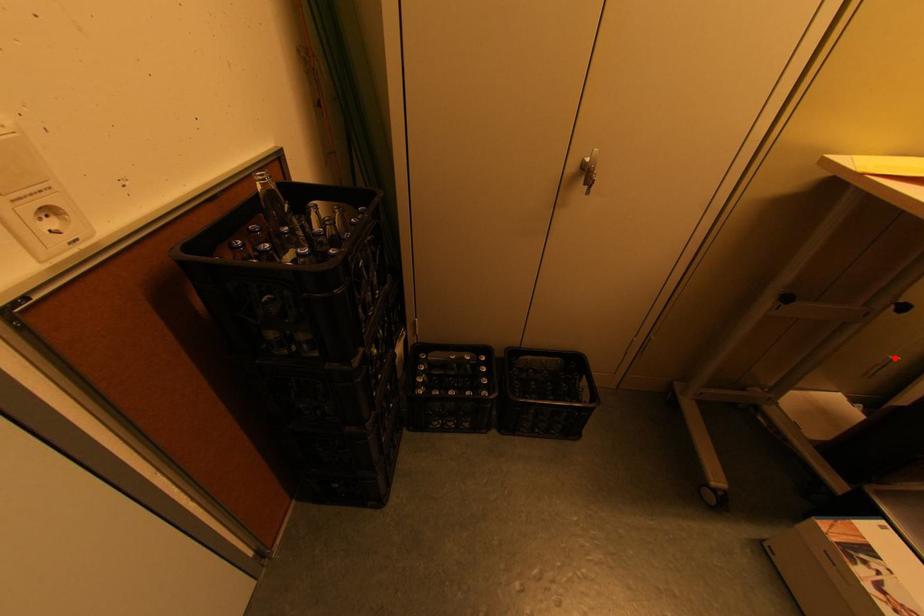
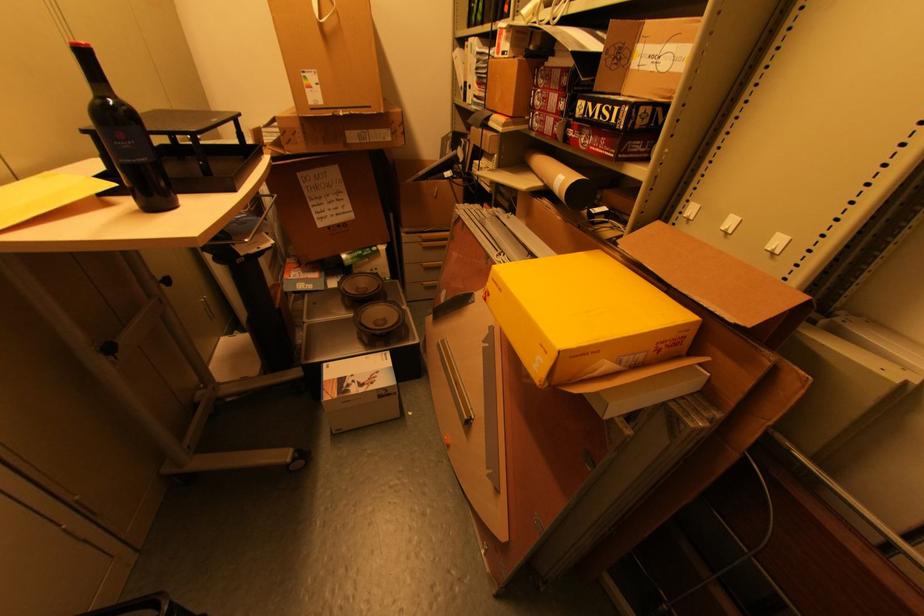
Question: I am providing you with two images of the same scene from different viewpoints. A red point is shown in image1. For the corresponding object point in image2, is it positioned nearer or farther from the camera?

Choices:
 (A) Nearer
 (B) Farther

Answer: (B)